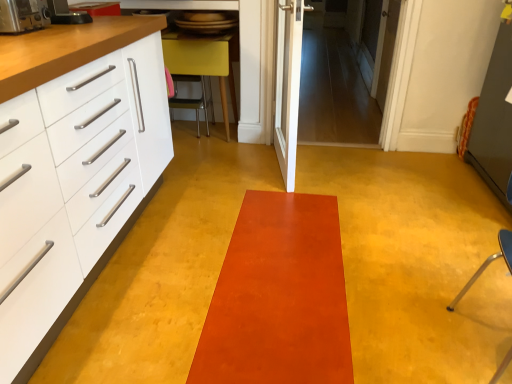
Find the location of `vacant area that lies between blue plastic chair at right, which ranks as the 1th furniture in bottom-to-top order, and white glossy door at center, the first door in the front-to-back sequence`. vacant area that lies between blue plastic chair at right, which ranks as the 1th furniture in bottom-to-top order, and white glossy door at center, the first door in the front-to-back sequence is located at coordinates (381, 254).